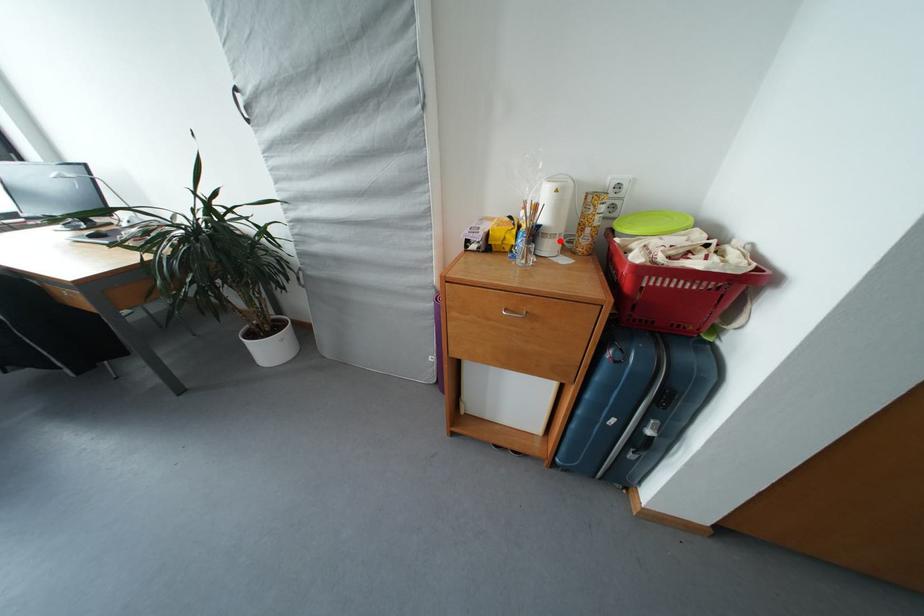
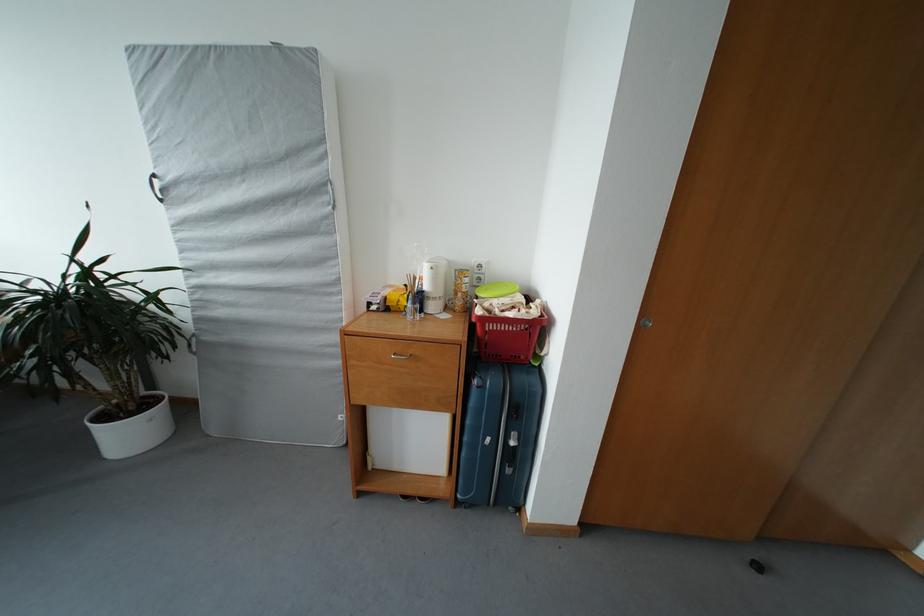
Locate, in the second image, the point that corresponds to the highlighted location in the first image.

(441, 304)